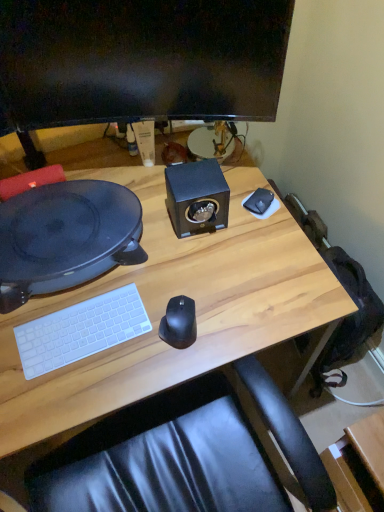
The width and height of the screenshot is (384, 512). In order to click on empty space that is ontop of black plastic record player at left in this screenshot , I will do point(63,219).